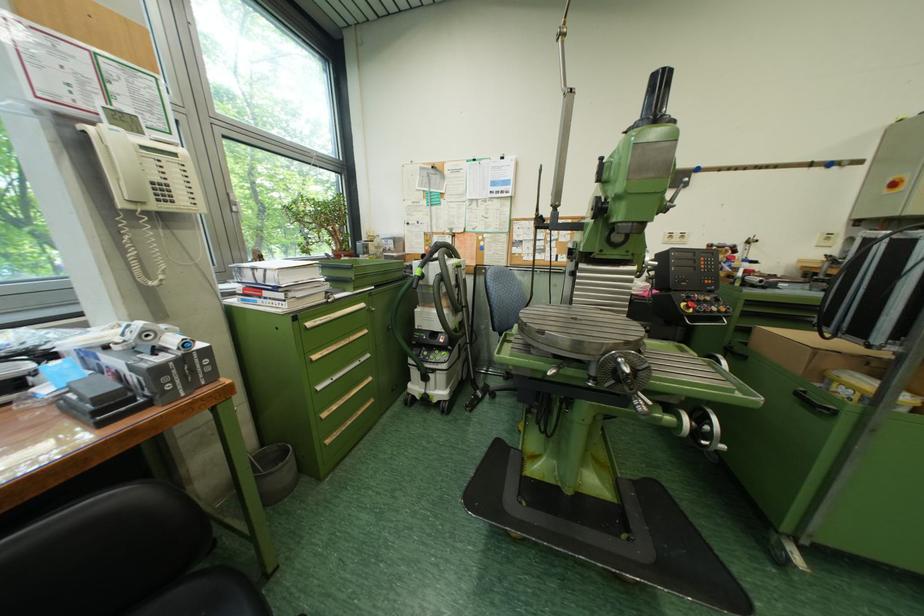
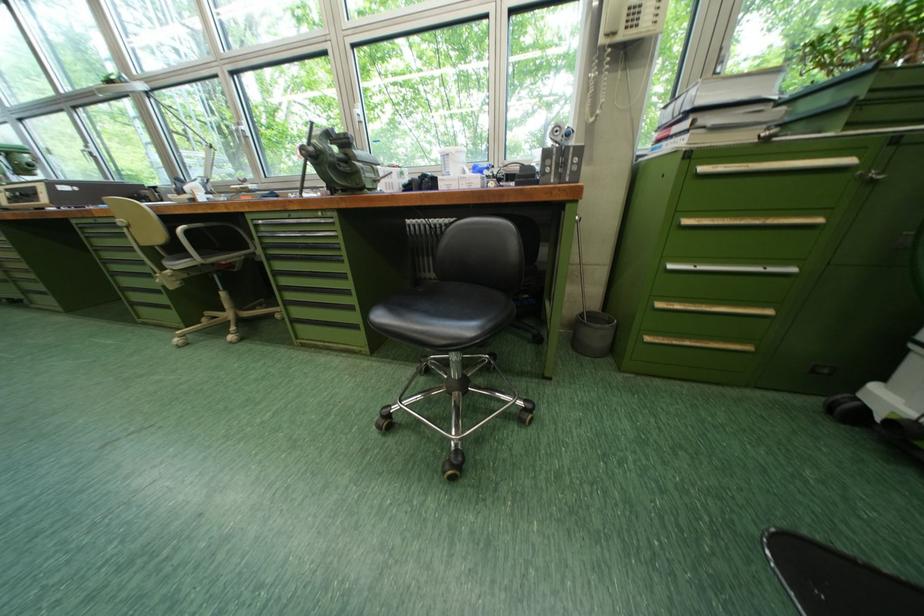
First-person continuous shooting, in which direction is the camera rotating?

The rotation direction of the camera is left-down.